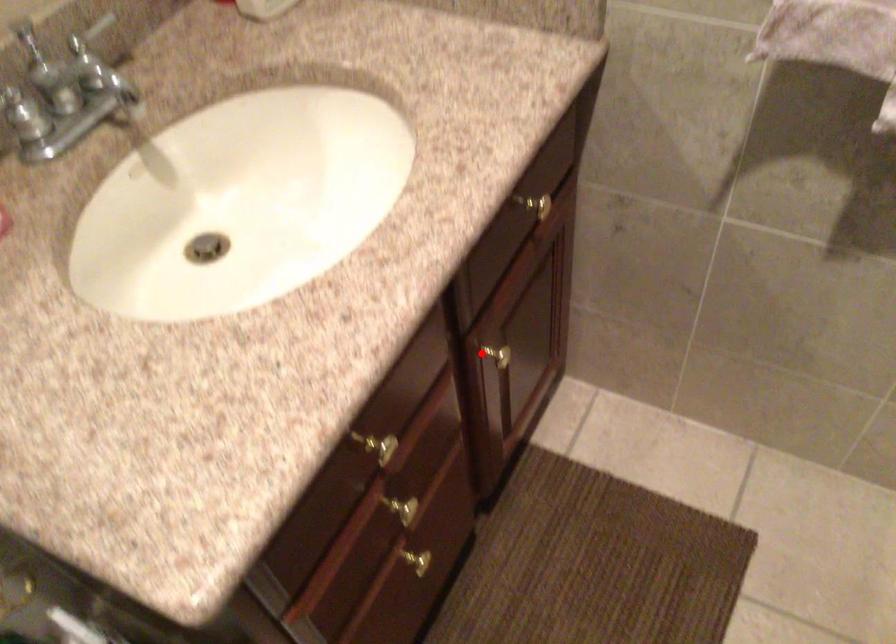
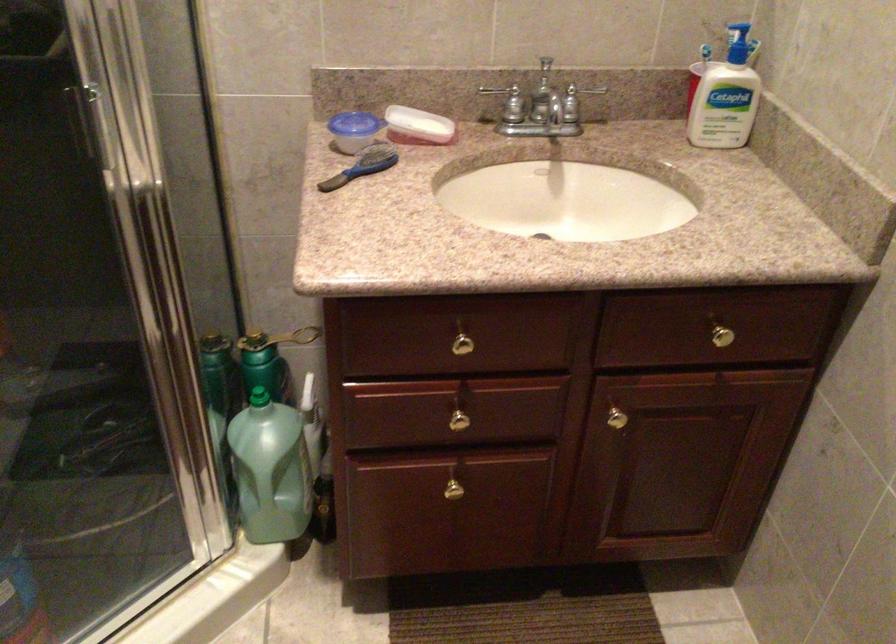
Find the pixel in the second image that matches the highlighted location in the first image.

(612, 411)